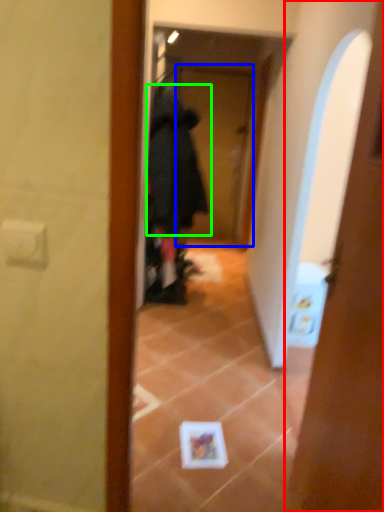
Question: Which object is positioned farthest from door (highlighted by a red box)? Select from screen door (highlighted by a blue box) and bathrobe (highlighted by a green box).

Choices:
 (A) screen door
 (B) bathrobe

Answer: (A)